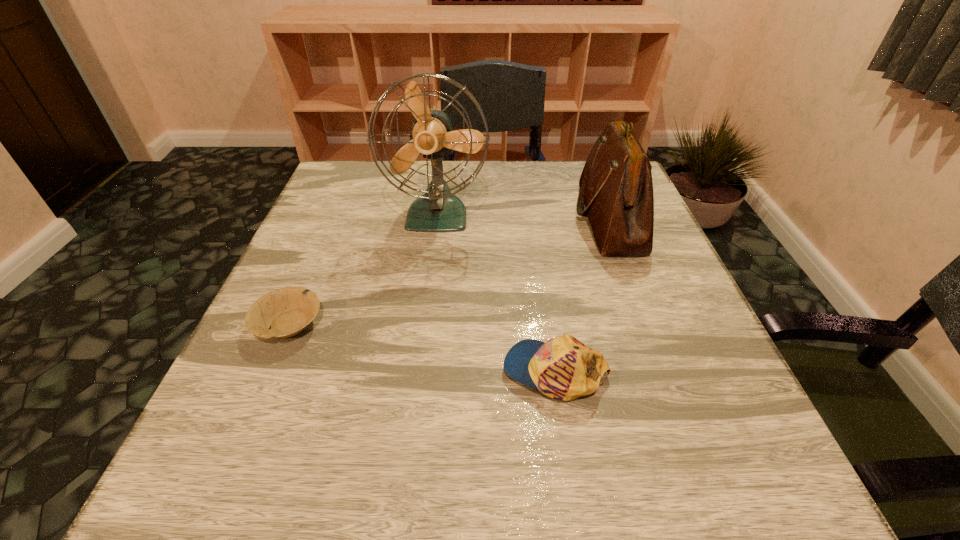
This screenshot has width=960, height=540. Find the location of `vacant space at the left edge of the desktop`. vacant space at the left edge of the desktop is located at coordinates [x=336, y=293].

Where is `vacant space at the right edge`? Image resolution: width=960 pixels, height=540 pixels. vacant space at the right edge is located at coordinates (607, 272).

The width and height of the screenshot is (960, 540). In the image, there is a desktop. What are the coordinates of `blank space at the far left corner` in the screenshot? It's located at (364, 178).

Where is `free space between the third tallest object and the bowl`? This screenshot has height=540, width=960. free space between the third tallest object and the bowl is located at coordinates (x=422, y=348).

Find the location of a particular element. free space between the leftmost object and the shoulder bag is located at coordinates (449, 272).

This screenshot has width=960, height=540. I want to click on vacant space in between the shortest object and the rightmost object, so click(449, 272).

Where is `unoccupied position between the rightmost object and the fan`? This screenshot has height=540, width=960. unoccupied position between the rightmost object and the fan is located at coordinates (523, 217).

Find the location of a particular element. The image size is (960, 540). vacant space that's between the bowl and the fan is located at coordinates (363, 269).

In order to click on empty location between the third tallest object and the shoulder bag in this screenshot , I will do `click(582, 295)`.

Where is `empty space that is in between the third shortest object and the second shortest object`? empty space that is in between the third shortest object and the second shortest object is located at coordinates (582, 295).